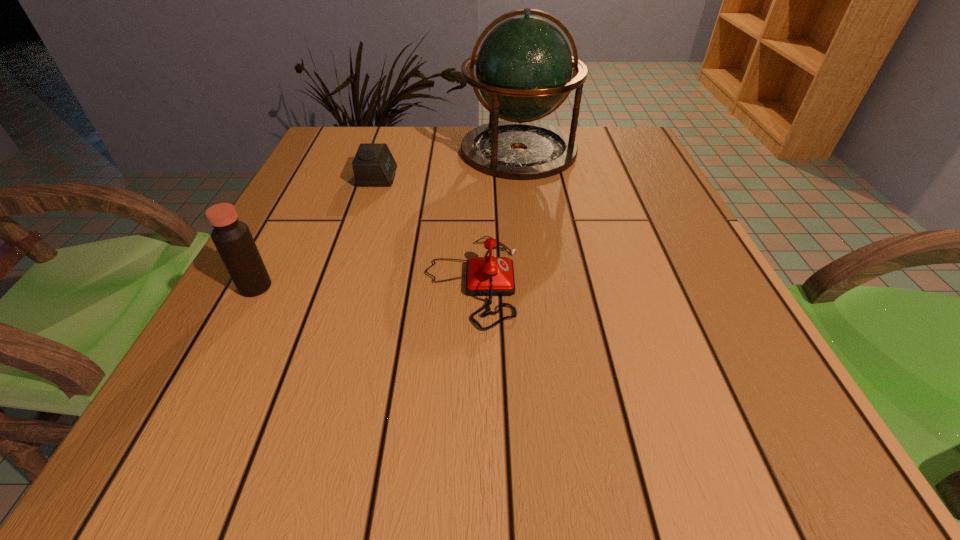
This screenshot has height=540, width=960. I want to click on alarm clock at the far edge, so click(373, 165).

Find the location of a particular element. This screenshot has height=540, width=960. vinegar that is at the left edge is located at coordinates (233, 240).

This screenshot has width=960, height=540. What are the coordinates of `alarm clock located at the left edge` in the screenshot? It's located at (373, 165).

The width and height of the screenshot is (960, 540). What are the coordinates of `object that is at the far left corner` in the screenshot? It's located at (373, 165).

Locate an element on the screen. vacant region at the near edge of the desktop is located at coordinates (609, 467).

Find the location of a particular element. vacant space at the left edge is located at coordinates (307, 258).

You are a GUI agent. You are given a task and a screenshot of the screen. Output one action in this format:
    pyautogui.click(x=<x>, y=<y>)
    Task: Click on the vacant area at the right edge
    This screenshot has height=540, width=960.
    Given the screenshot: What is the action you would take?
    pyautogui.click(x=641, y=246)

At what (x,y) coordinates should I click in order to perform the action: click on free space at the far right corner of the desktop. Please return your answer as a coordinate pair (x, y). Looking at the image, I should click on (597, 141).

Locate an element on the screen. free spot between the second object from left to right and the telephone is located at coordinates (425, 229).

Find the location of a particular element. This screenshot has height=540, width=960. unoccupied position between the telephone and the third object from right to left is located at coordinates coord(425,229).